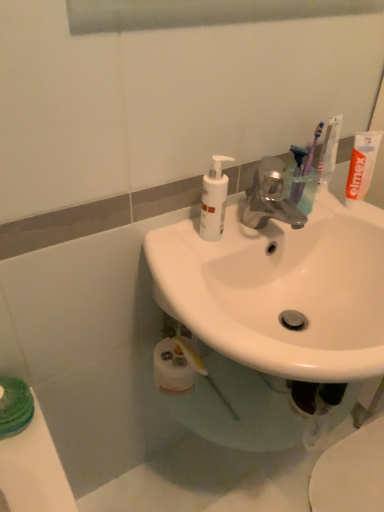
I want to click on vacant area in front of white matte pump bottle at upper center, so click(x=199, y=278).